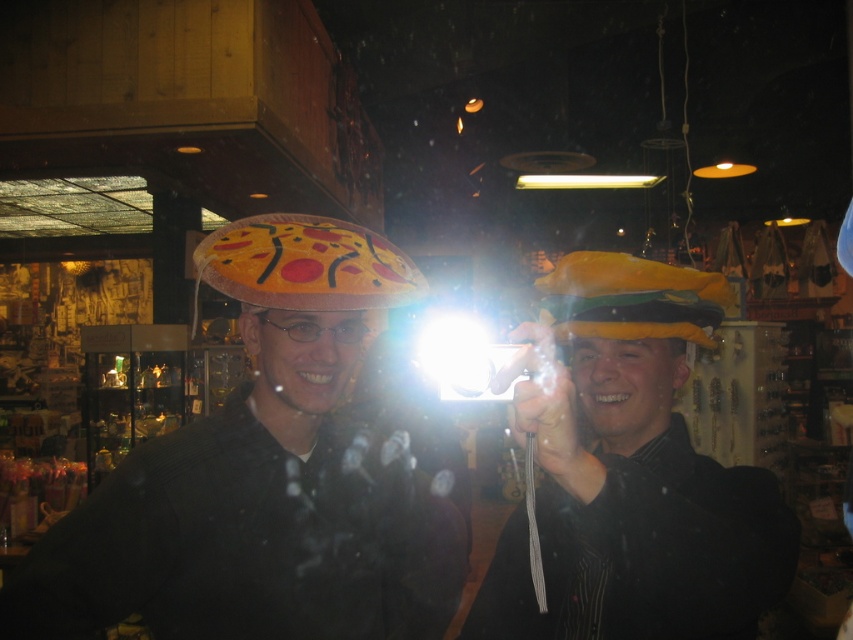
You are standing in a gift shop and see two points marked in the image. The first point is at position point (583, 516) and the second is at point (619, 291). Which point is closer to you?

Point (583, 516) is in front of point (619, 291), so it is closer to you.

You are a customer in the store and want to place both the yellow fabric hat at center and the felt pizza at center on a shelf. The shelf has a width of 14 inches. Can both items fit side by side on the shelf without overlapping?

The yellow fabric hat at center and felt pizza at center are 13.69 inches apart, so they can fit side by side on the 14 inch shelf since the total width required is less than the shelf width.